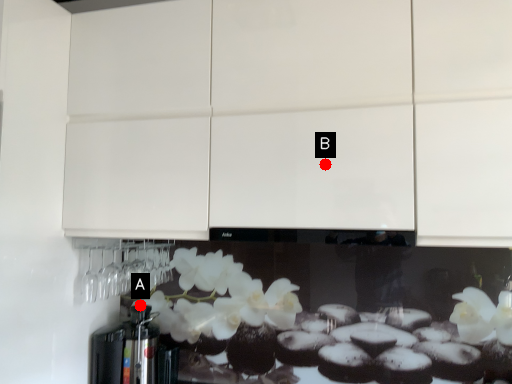
Question: Two points are circled on the image, labeled by A and B beside each circle. Which point is closer to the camera?

Choices:
 (A) A is closer
 (B) B is closer

Answer: (B)